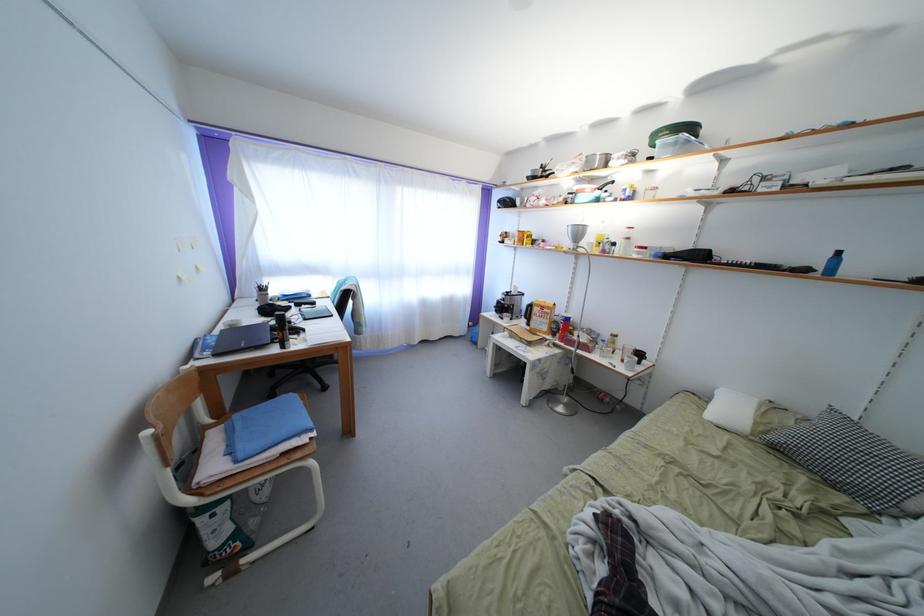
Find where to sit the wooden chair sitting surface. Please return your answer as a coordinate pair (x, y).

(235, 454)